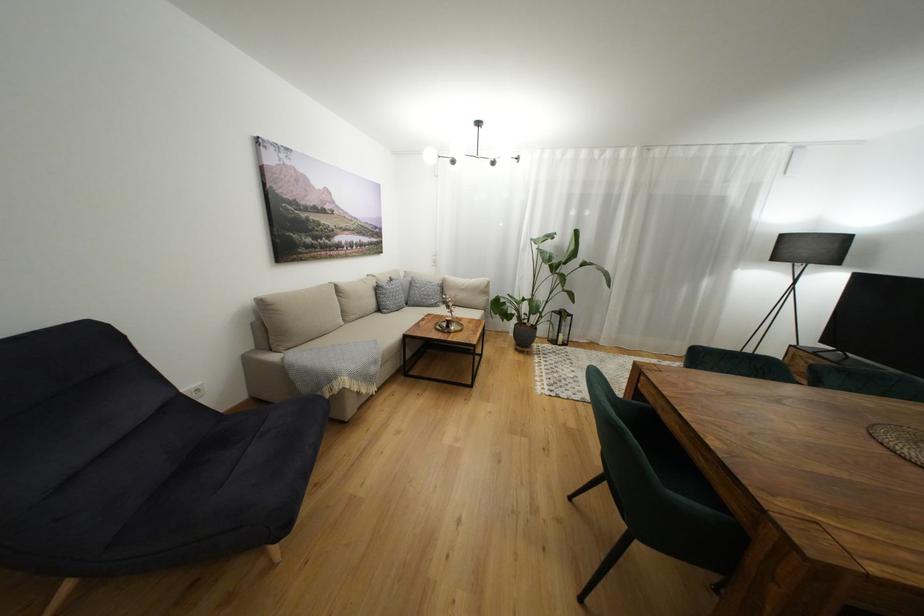
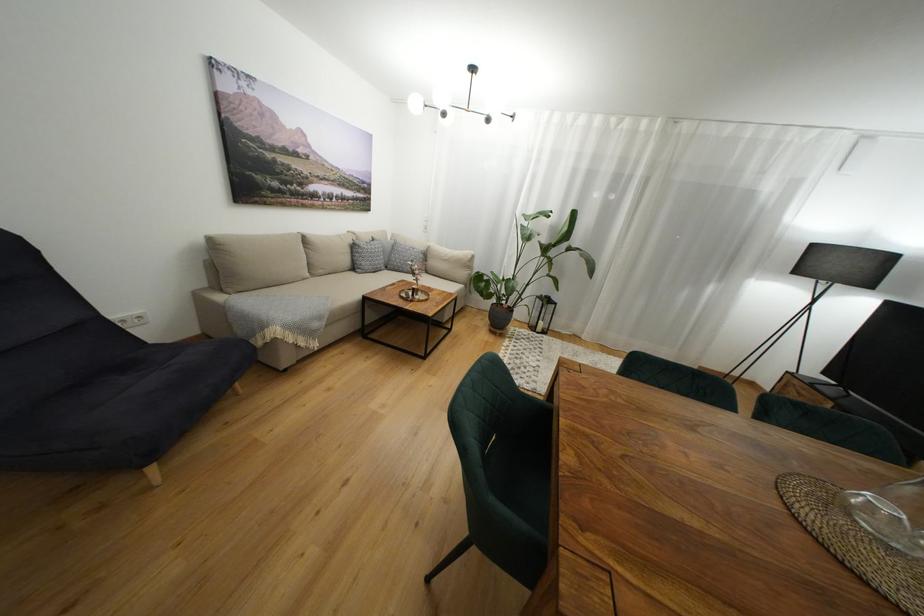
Question: The images are taken continuously from a first-person perspective. In which direction are you moving?

Choices:
 (A) Left
 (B) Right
 (C) Forward
 (D) Backward

Answer: (B)